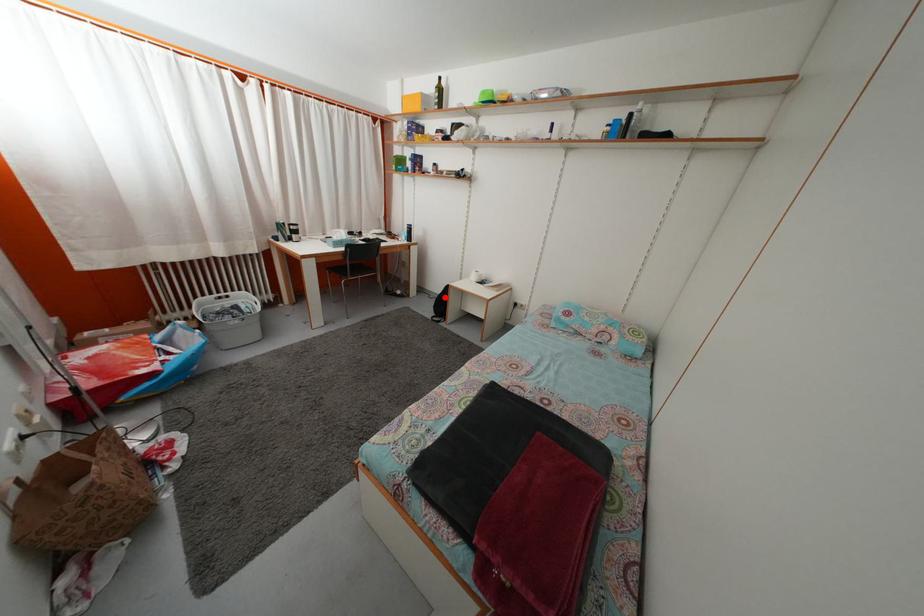
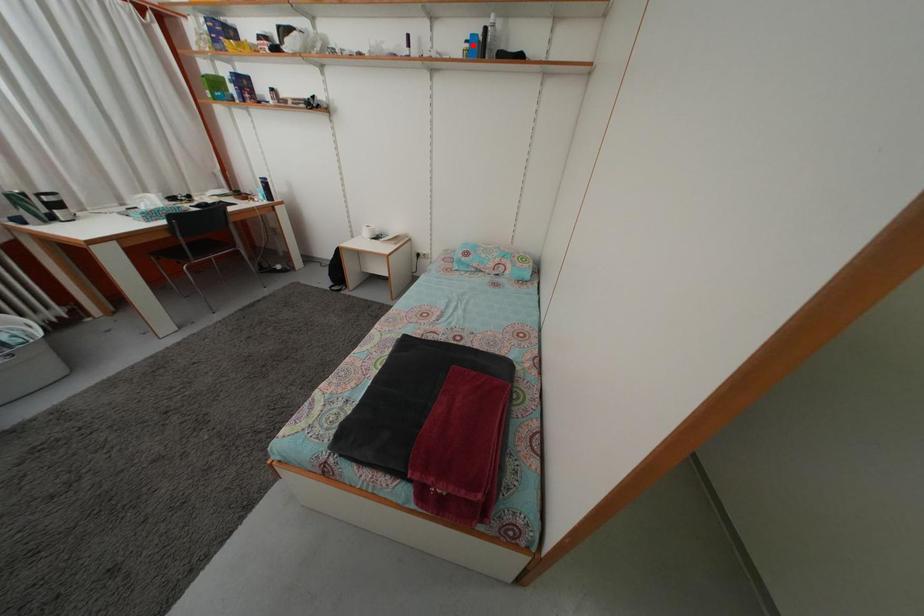
I am providing you with two images of the same scene from different viewpoints. A red point is marked on the first image and another point is marked on the second image. Does the point marked in image1 correspond to the same location as the one in image2?

No